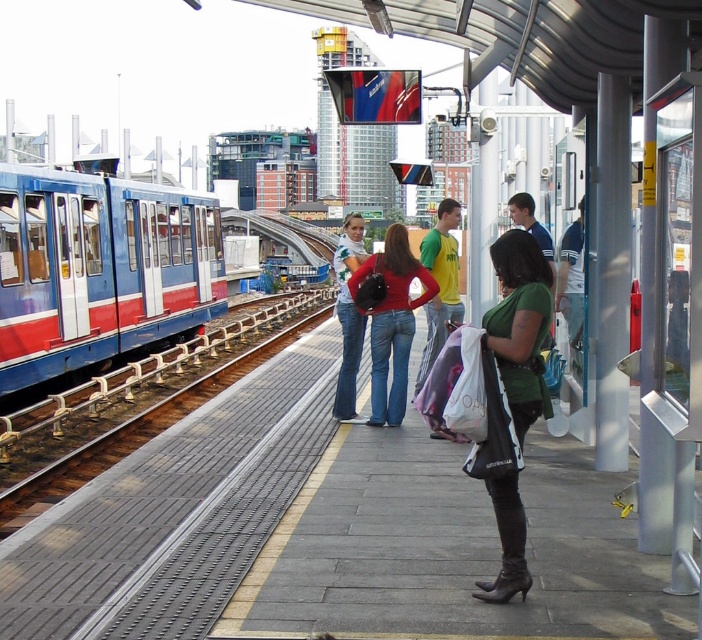
Question: Does green leather jacket at center appear on the left side of matte red sweater at center?

Choices:
 (A) no
 (B) yes

Answer: (A)

Question: Considering the relative positions of blue matte train at left and matte red sweater at center in the image provided, where is blue matte train at left located with respect to matte red sweater at center?

Choices:
 (A) below
 (B) above

Answer: (B)

Question: Which object is the farthest from the blue matte train at left?

Choices:
 (A) matte green shirt at center
 (B) metal/textured train track at left
 (C) matte red sweater at center
 (D) green leather jacket at center

Answer: (A)

Question: Can you confirm if matte green shirt at center is bigger than green leather jacket at center?

Choices:
 (A) no
 (B) yes

Answer: (A)

Question: Which object is positioned farthest from the metal/textured train track at left?

Choices:
 (A) leather high-heeled boot at lower center
 (B) matte green shirt at center
 (C) blue matte train at left

Answer: (B)

Question: Among these points, which one is nearest to the camera?

Choices:
 (A) (72, 449)
 (B) (529, 339)

Answer: (B)